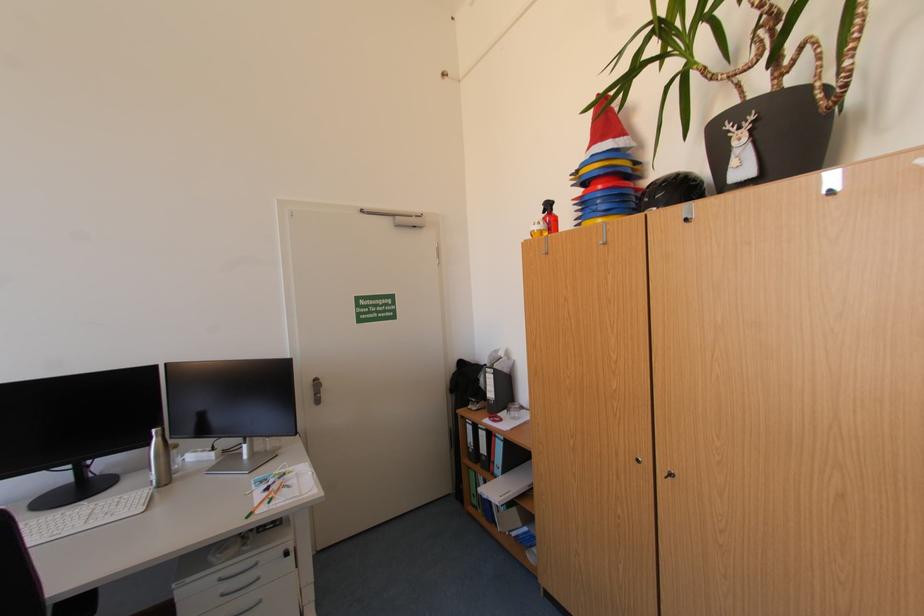
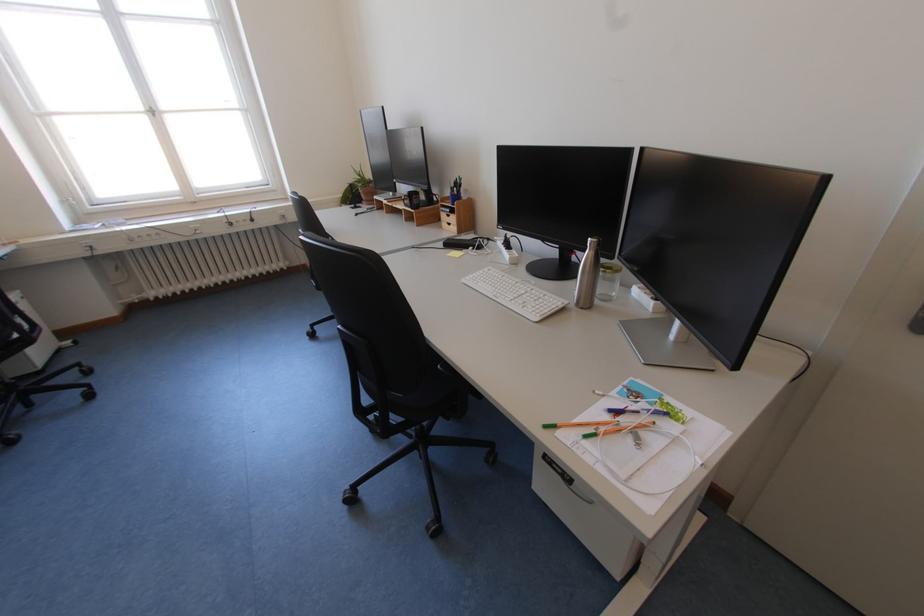
Locate, in the second image, the point that corresponds to (x=161, y=431) in the first image.

(599, 240)